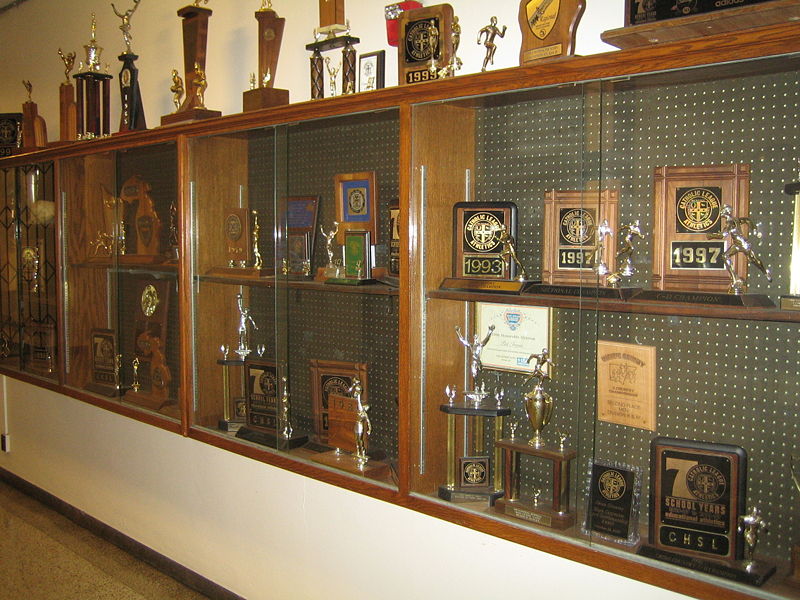
Image resolution: width=800 pixels, height=600 pixels. I want to click on picture frame, so click(552, 329).